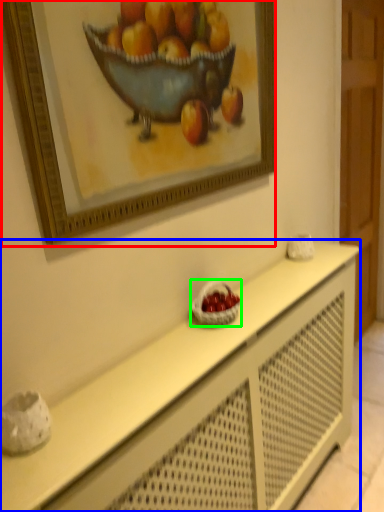
Question: Considering the real-world distances, which object is closest to picture frame (highlighted by a red box)? table (highlighted by a blue box) or basket (highlighted by a green box).

Choices:
 (A) table
 (B) basket

Answer: (B)